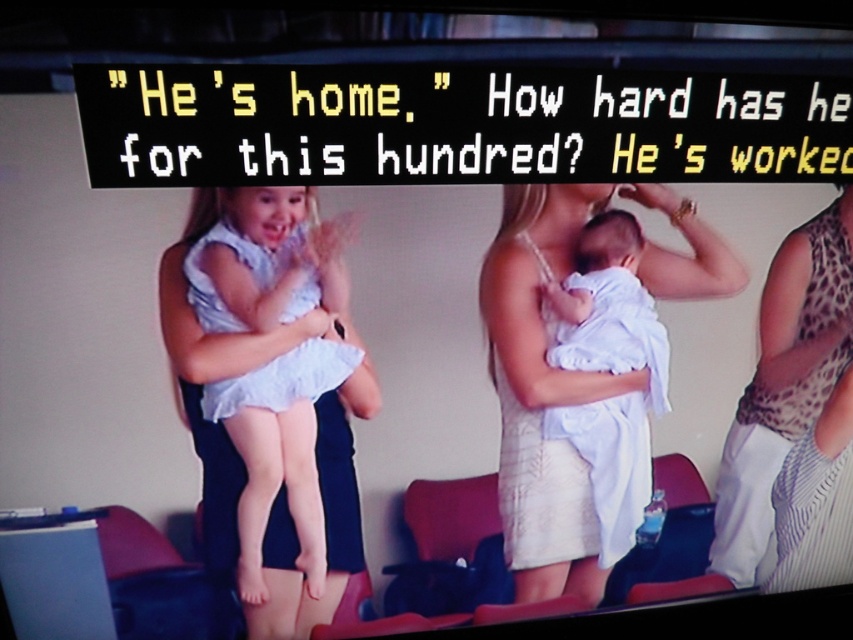
Question: Which point is closer to the camera?

Choices:
 (A) (378, 404)
 (B) (630, 227)
 (C) (595, 564)

Answer: (B)

Question: Is white lace dress at center smaller than leopard print dress at right?

Choices:
 (A) yes
 (B) no

Answer: (B)

Question: Does light blue fabric dress at center have a greater width compared to white clothed baby at center?

Choices:
 (A) yes
 (B) no

Answer: (A)

Question: Which point is closer to the camera?

Choices:
 (A) white lace dress at center
 (B) leopard print dress at right
 (C) white clothed baby at center
 (D) light blue fabric dress at center

Answer: (D)

Question: From the image, what is the correct spatial relationship of white lace dress at center in relation to leopard print dress at right?

Choices:
 (A) left
 (B) right

Answer: (A)

Question: Among these objects, which one is farthest from the camera?

Choices:
 (A) white lace dress at center
 (B) leopard print dress at right
 (C) light blue fabric dress at center
 (D) white clothed baby at center

Answer: (B)